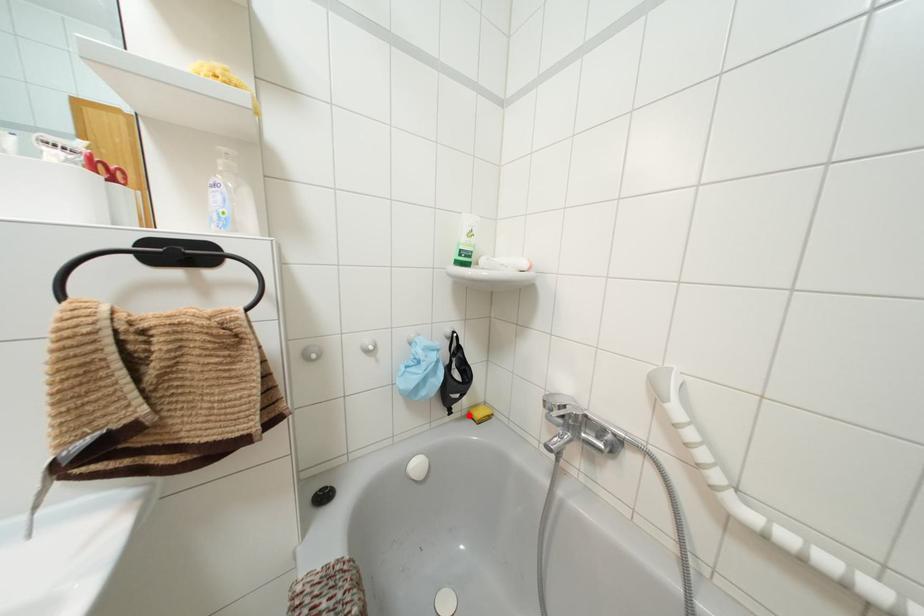
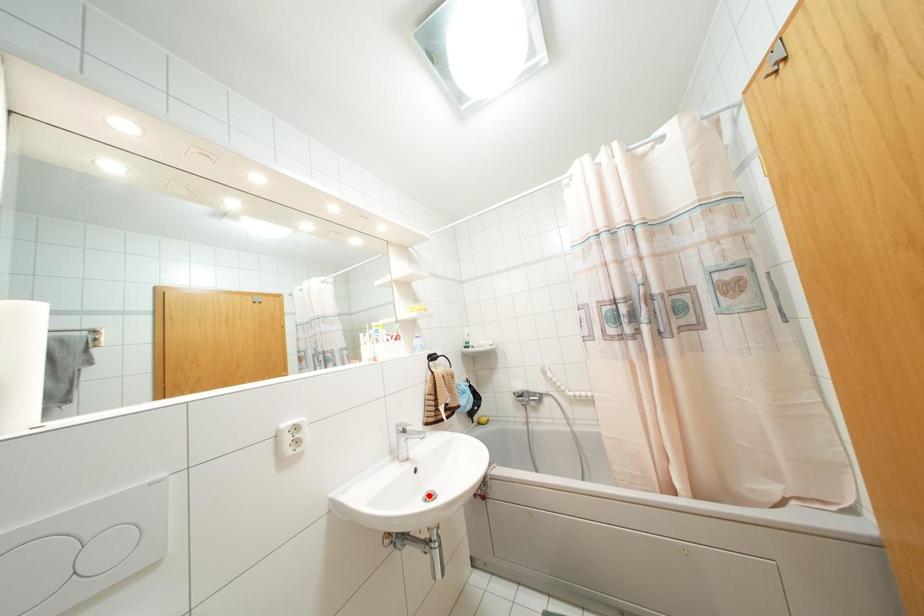
I am providing you with two images of the same scene from different viewpoints. A red point is marked on the first image and another point is marked on the second image. Do the highlighted points in image1 and image2 indicate the same real-world spot?

No